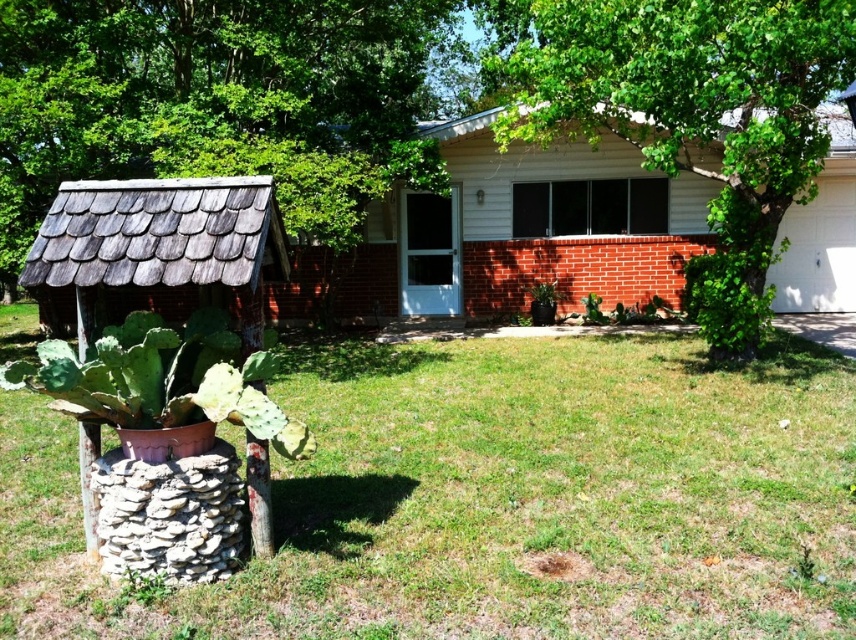
Question: Which of the following is the closest to the observer?

Choices:
 (A) (153, 36)
 (B) (830, 35)
 (C) (218, 584)

Answer: (C)

Question: Which of the following is the farthest from the observer?

Choices:
 (A) green grass at lower center
 (B) green leafy tree at left
 (C) green leafy tree at center

Answer: (B)

Question: Is green grass at lower center positioned before green leafy tree at center?

Choices:
 (A) no
 (B) yes

Answer: (B)

Question: Which point is farther to the camera?

Choices:
 (A) (694, 120)
 (B) (61, 125)
 (C) (764, 449)

Answer: (B)

Question: Is green grass at lower center bigger than green leafy tree at left?

Choices:
 (A) yes
 (B) no

Answer: (B)

Question: Is the position of green leafy tree at left more distant than that of green leafy tree at center?

Choices:
 (A) yes
 (B) no

Answer: (A)